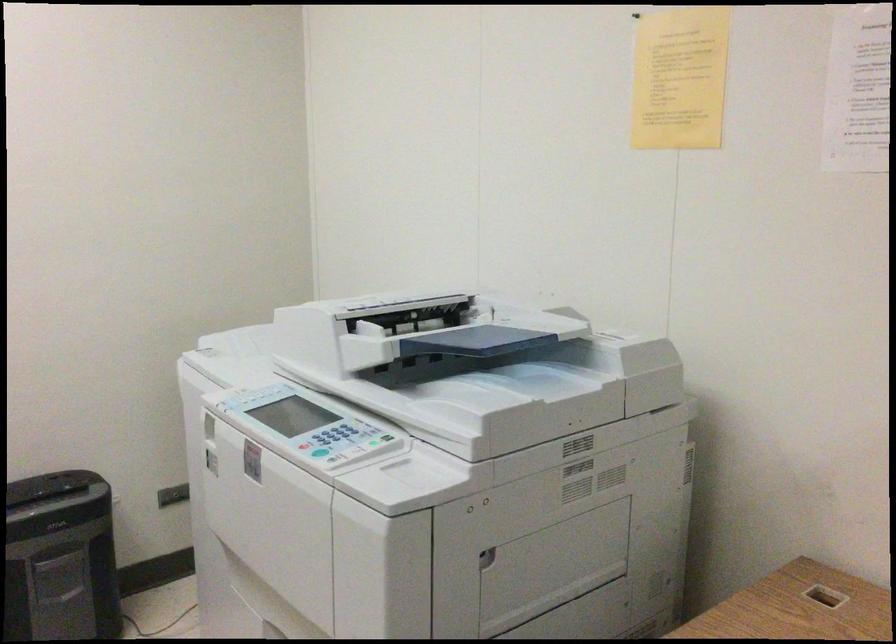
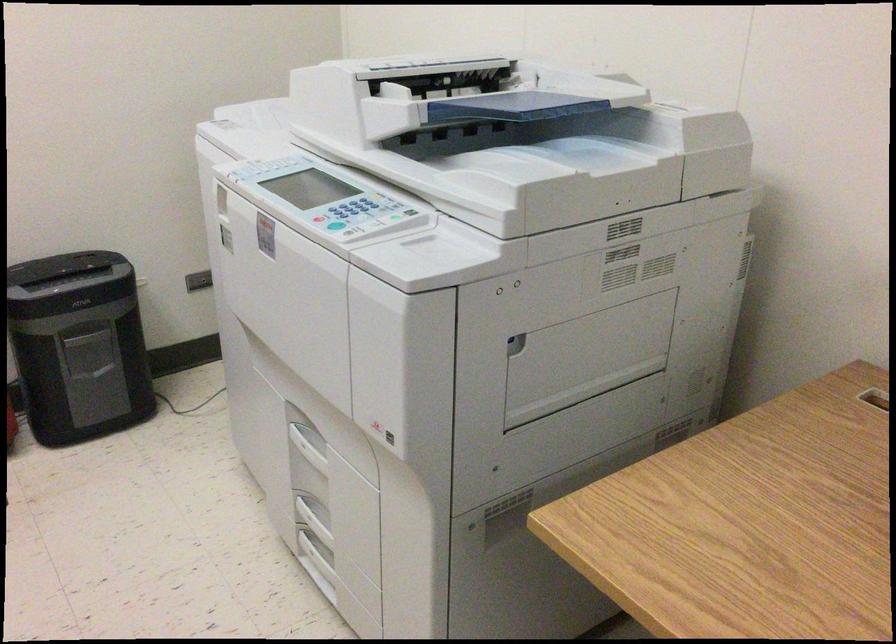
Where in the second image is the point corresponding to the point at 328,440 from the first image?

(343, 214)